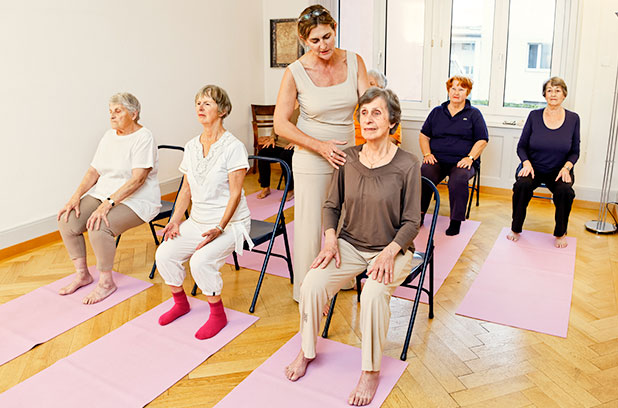
The height and width of the screenshot is (408, 618). In order to click on chairs in this screenshot , I will do `click(164, 206)`, `click(255, 227)`, `click(432, 258)`, `click(541, 184)`, `click(476, 175)`, `click(254, 120)`.